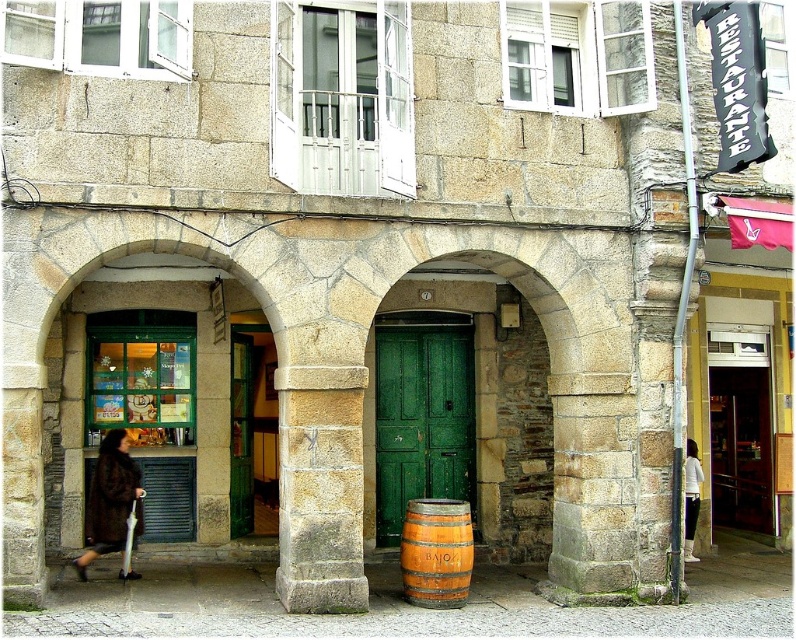
You are standing in front of the stone building and want to determine the relative positions of two points marked in the image. Which of the two points, point 1 at coordinates point (412, 592) or point 2 at coordinates point (693, 556), is closer to you?

Point 1 at coordinates point (412, 592) is closer to the viewer than point 2 at coordinates point (693, 556).

You are a photographer standing in front of the stone building with two arched doorways. You notice a brown fur coat at lower left and a white fabric pants at right in the scene. Which clothing item is located more to the left side?

The brown fur coat at lower left is more to the left side than the white fabric pants at right.